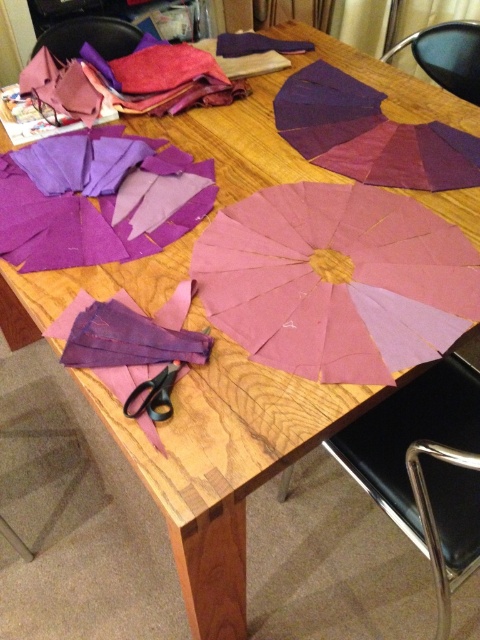
Question: Considering the real-world distances, which object is farthest from the purple paper umbrella at upper center?

Choices:
 (A) purple matte umbrella at center
 (B) pink paper umbrella at center
 (C) black leather chair at lower right

Answer: (C)

Question: Considering the real-world distances, which object is farthest from the black leather chair at lower right?

Choices:
 (A) pink paper umbrella at center
 (B) purple matte umbrella at center

Answer: (B)

Question: Can you confirm if purple paper umbrella at upper center is thinner than black plastic scissors at lower left?

Choices:
 (A) no
 (B) yes

Answer: (A)

Question: Which point is closer to the camera?

Choices:
 (A) click(x=104, y=54)
 (B) click(x=104, y=211)
 (C) click(x=292, y=352)

Answer: (C)

Question: Is purple felt cloth at center smaller than black plastic chair at upper left?

Choices:
 (A) no
 (B) yes

Answer: (A)

Question: Is the position of pink paper umbrella at center more distant than that of black plastic chair at upper left?

Choices:
 (A) yes
 (B) no

Answer: (B)